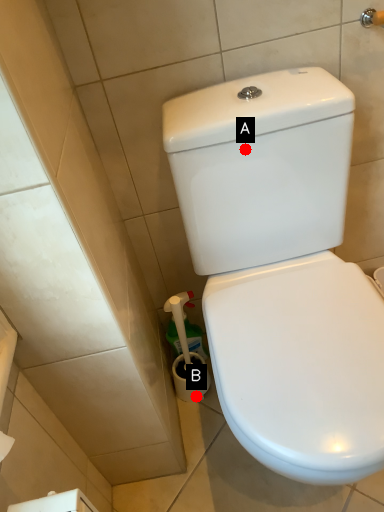
Question: Two points are circled on the image, labeled by A and B beside each circle. Which point is farther to the camera?

Choices:
 (A) A is further
 (B) B is further

Answer: (B)